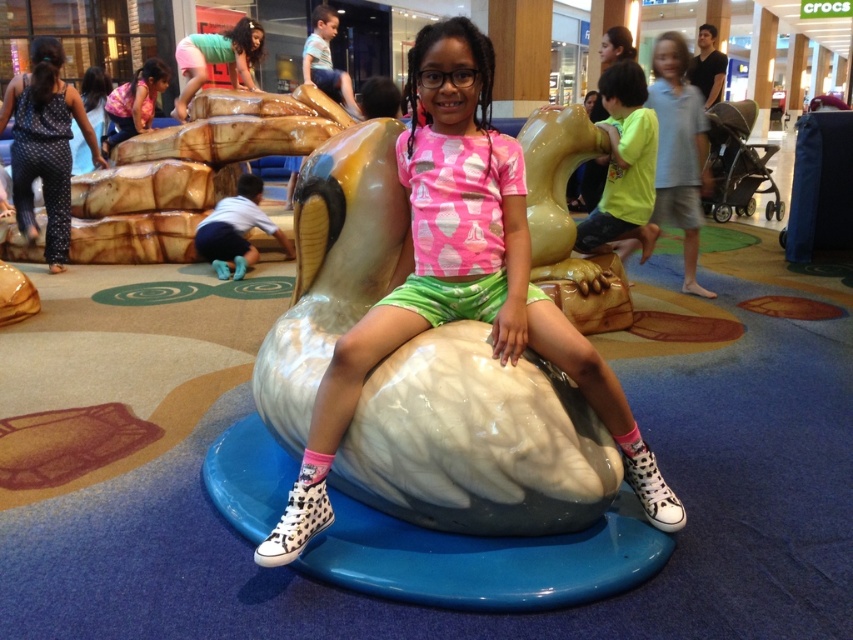
Between white glossy dolphin at center and green textured shirt at upper right, which one is positioned lower?

white glossy dolphin at center is below.

Which of these two, white glossy dolphin at center or green textured shirt at upper right, stands taller?

Standing taller between the two is white glossy dolphin at center.

Who is more forward, (672, 518) or (630, 166)?

Positioned in front is point (672, 518).

Identify the location of white glossy dolphin at center. The image size is (853, 640). (457, 282).

Is blue rubber gloves at lower center above matte pink shirt at upper center?

No, blue rubber gloves at lower center is not above matte pink shirt at upper center.

The image size is (853, 640). What do you see at coordinates (236, 230) in the screenshot?
I see `blue rubber gloves at lower center` at bounding box center [236, 230].

Is point (199, 253) less distant than point (112, 124)?

Yes.

This screenshot has height=640, width=853. Identify the location of blue rubber gloves at lower center. click(236, 230).

Looking at this image, which is more to the right, green textured shirt at upper right or matte pink shirt at upper center?

green textured shirt at upper right is more to the right.

In the scene shown: Does green textured shirt at upper right have a lesser width compared to matte pink shirt at upper center?

Yes, green textured shirt at upper right is thinner than matte pink shirt at upper center.

What do you see at coordinates (624, 164) in the screenshot?
I see `green textured shirt at upper right` at bounding box center [624, 164].

Where is `green textured shirt at upper right`? The width and height of the screenshot is (853, 640). green textured shirt at upper right is located at coordinates (624, 164).